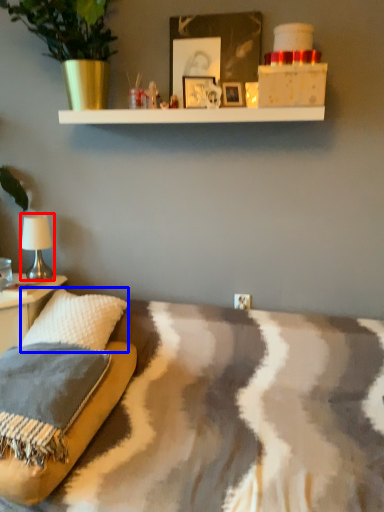
Question: Which point is closer to the camera, table lamp (highlighted by a red box) or throw pillow (highlighted by a blue box)?

Choices:
 (A) table lamp
 (B) throw pillow

Answer: (B)